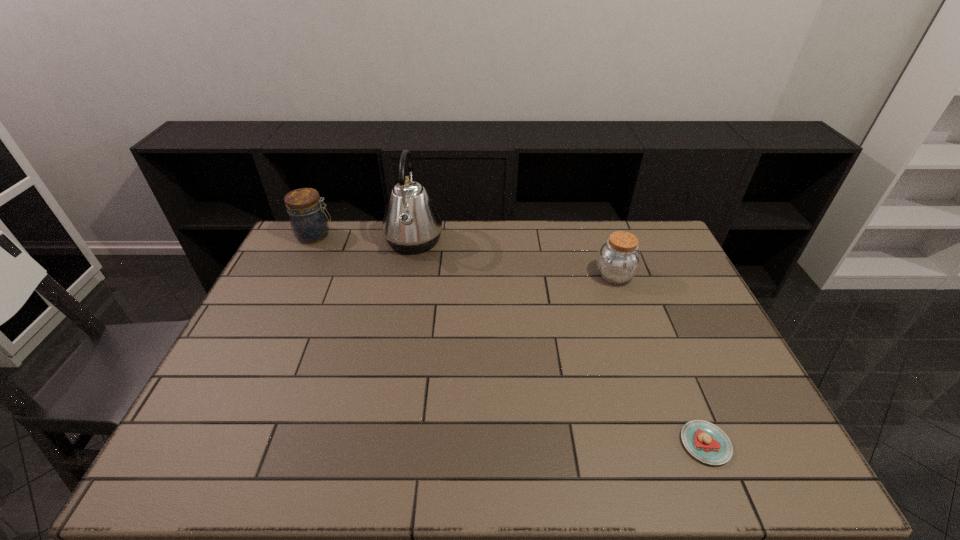
The image size is (960, 540). I want to click on free space between the second shortest object and the kettle, so click(515, 258).

In order to click on free point between the nearer jar and the nearest object in this screenshot , I will do `click(660, 360)`.

I want to click on vacant area that lies between the shortest object and the right jar, so click(660, 360).

This screenshot has width=960, height=540. In order to click on free space between the kettle and the left jar in this screenshot , I will do `click(364, 238)`.

Where is `object that stands as the second closest to the third tallest object`? Image resolution: width=960 pixels, height=540 pixels. object that stands as the second closest to the third tallest object is located at coordinates [411, 224].

The height and width of the screenshot is (540, 960). In order to click on the closest object relative to the pastry in this screenshot , I will do `click(618, 260)`.

Where is `vacant region that satisfies the following two spatial constraints: 1. from the spout of the second object from left to right; 2. on the back side of the right jar`? This screenshot has width=960, height=540. vacant region that satisfies the following two spatial constraints: 1. from the spout of the second object from left to right; 2. on the back side of the right jar is located at coordinates (407, 275).

Identify the location of free location that satisfies the following two spatial constraints: 1. on the lid of the left jar; 2. on the back side of the nearer jar. (296, 275).

Locate an element on the screen. This screenshot has width=960, height=540. vacant position in the image that satisfies the following two spatial constraints: 1. on the lid of the nearest object; 2. on the left side of the left jar is located at coordinates (215, 443).

Find the location of a particular element. The height and width of the screenshot is (540, 960). vacant space that satisfies the following two spatial constraints: 1. from the spout of the nearer jar; 2. on the left side of the kettle is located at coordinates (407, 275).